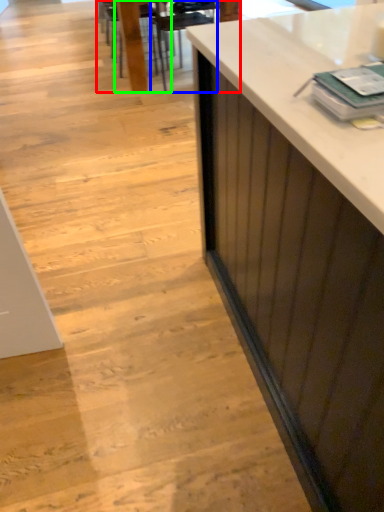
Question: Which is nearer to the table (highlighted by a red box)? armchair (highlighted by a blue box) or chair (highlighted by a green box).

Choices:
 (A) armchair
 (B) chair

Answer: (B)